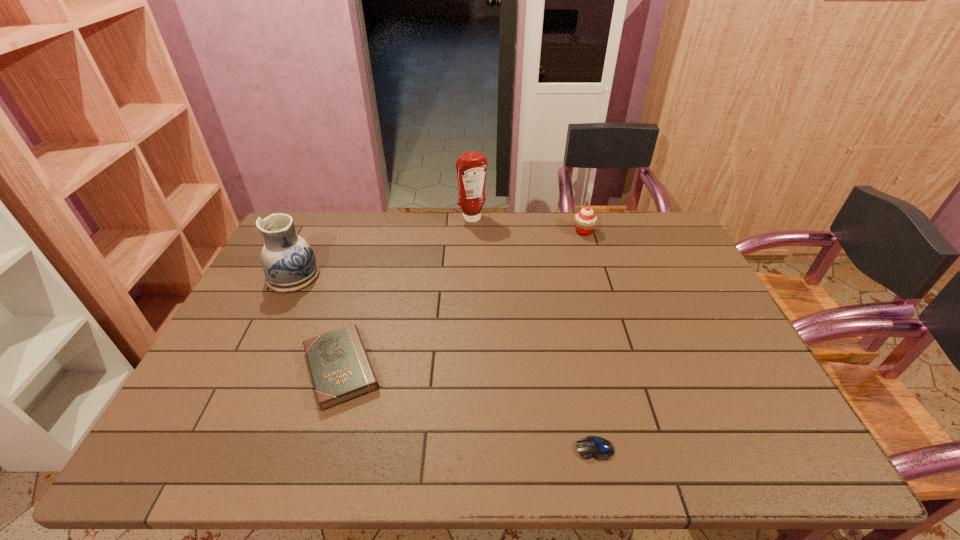
This screenshot has width=960, height=540. What are the coordinates of `the tallest object` in the screenshot? It's located at (471, 167).

Locate an element on the screen. the third object from right to left is located at coordinates (471, 167).

I want to click on pottery, so click(x=289, y=264).

This screenshot has width=960, height=540. Find the location of `the third nearest object`. the third nearest object is located at coordinates [x=289, y=264].

At what (x,y) coordinates should I click in order to perform the action: click on the third tallest object. Please return your answer as a coordinate pair (x, y). The width and height of the screenshot is (960, 540). Looking at the image, I should click on (585, 221).

What are the coordinates of `the rightmost object` in the screenshot? It's located at (585, 221).

Identify the location of the second shortest object. (340, 368).

At what (x,y) coordinates should I click in order to perform the action: click on the second object from left to right. Please return your answer as a coordinate pair (x, y). Looking at the image, I should click on (340, 368).

You are a GUI agent. You are given a task and a screenshot of the screen. Output one action in this format:
    pyautogui.click(x=<x>, y=<y>)
    Task: Click on the second object from right to left
    
    Given the screenshot: What is the action you would take?
    pyautogui.click(x=599, y=448)

The width and height of the screenshot is (960, 540). In order to click on computer mouse in this screenshot , I will do `click(599, 448)`.